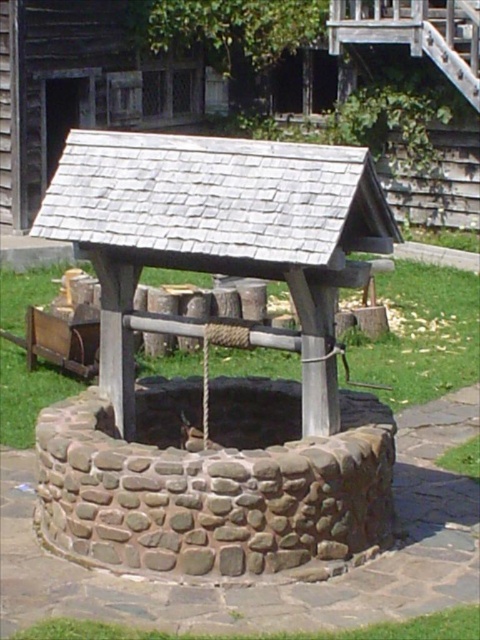
You are standing at the origin point of the image coordinate system. The gray stone well at center is located at coordinates. Can you tell me its exact position?

The gray stone well at center is located at the coordinates point (214,480).

You are standing in front of the well structure and want to pour water into a bucket. Which part of the well should you approach to access the water? The gray stone well at center or the stone textured well at center?

You should approach the gray stone well at center because it is in front of the stone textured well at center, making it the accessible part for pouring water.